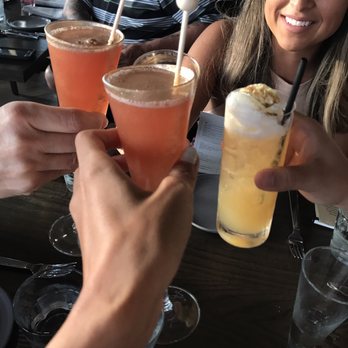
This screenshot has width=348, height=348. I want to click on table, so click(x=245, y=285).